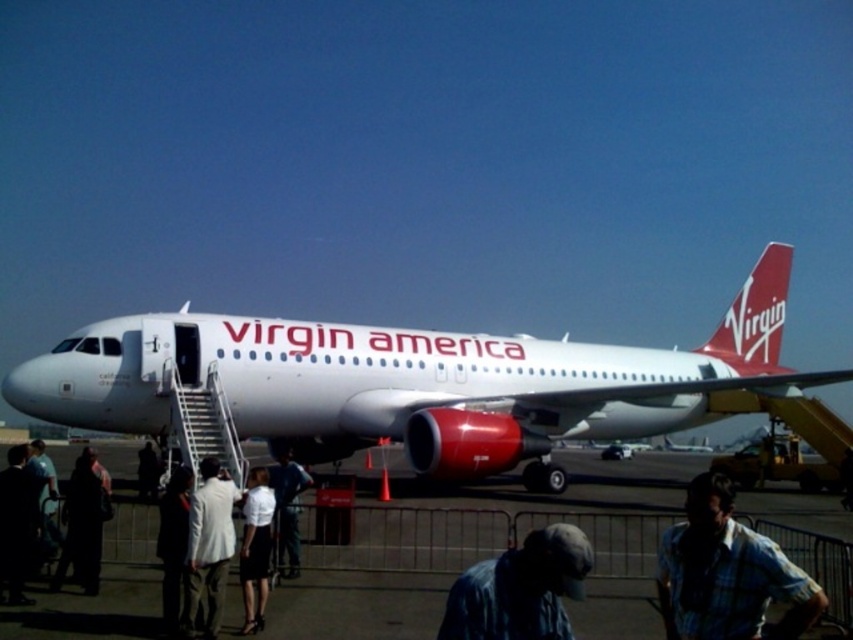
You are a passenger waiting to board the Virgin America airplane. You notice the smooth concrete runway at center and the dark fabric coat at lower left. Which object is positioned lower in the image?

The smooth concrete runway at center is located below the dark fabric coat at lower left, so the runway is positioned lower in the image.

You are a pilot standing at the airport control tower. You need to locate the white glossy airplane at center. What are its coordinates?

The white glossy airplane at center is located at coordinates point (410, 381).

You are standing at the origin point of the image coordinate system, which is the bottom left corner. The point representing the white glossy airplane at center is located at coordinate point (410, 381). If you want to walk towards the white glossy airplane at center, in which direction should you move? Please answer with either up, down, left, or right.

The white glossy airplane at center is located at coordinate point (410, 381). Since the origin is at the bottom left corner, the x and y coordinates increase to the right and upward respectively. Therefore, to reach the airplane, you should move right and up.